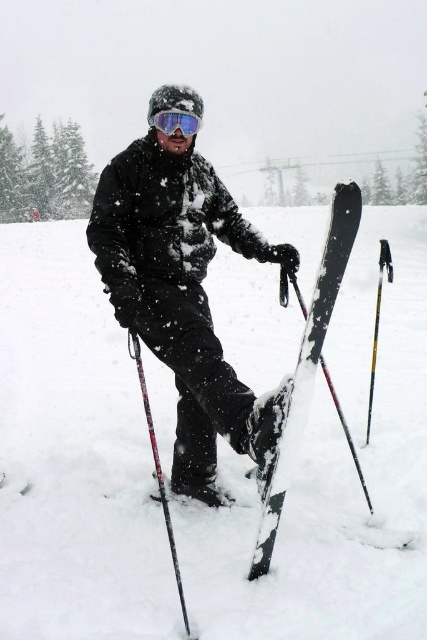
You are a photographer planning to take a photo of the white fluffy snow at center and the black textured ski pole at lower left. If your camera has a maximum focus range of 7 meters, will both objects be in focus at the same time?

The distance between the white fluffy snow at center and the black textured ski pole at lower left is 7.47 meters. Since the camera can only focus within 7 meters, the objects are too far apart to be in focus simultaneously.

You are a winter sports instructor preparing to demonstrate a snowboard technique. You see the white fluffy snow at center and the matte black snowboard at center. Which object is wider from your perspective?

The white fluffy snow at center is wider than the matte black snowboard at center according to the description.

You are a photographer trying to capture the perfect shot of the black textured ski pole at lower left and the transparent blue goggles at center. To ensure both are in frame, you need to know their relative positions. Which object is positioned to the left of the other?

The black textured ski pole at lower left is positioned to the left of the transparent blue goggles at center.